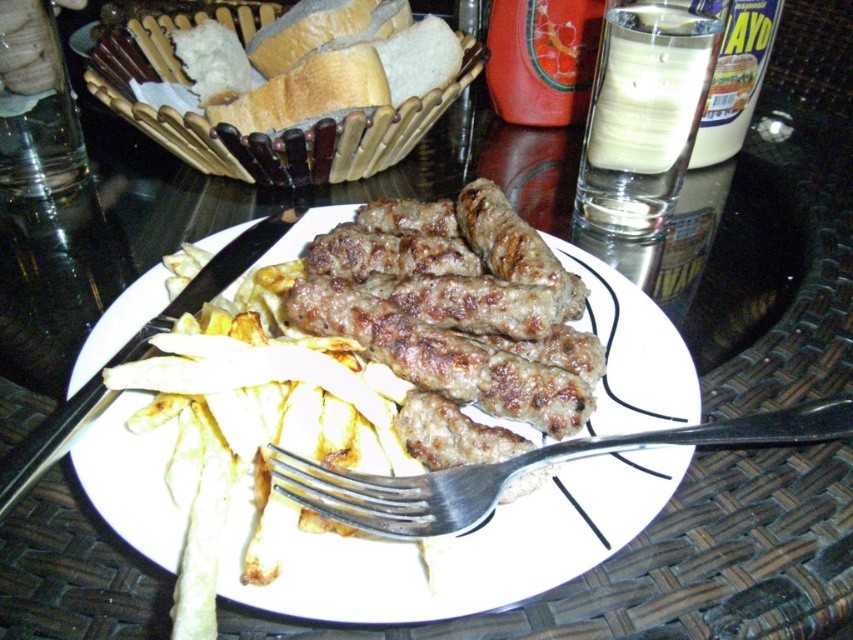
Who is positioned more to the left, clear glass at upper right or silver metallic fork at plate center?

Positioned to the left is silver metallic fork at plate center.

Locate an element on the screen. This screenshot has width=853, height=640. clear glass at upper right is located at coordinates (643, 113).

Which is in front, point (671, 64) or point (724, 444)?

Point (724, 444) is more forward.

Identify the location of clear glass at upper right. This screenshot has width=853, height=640. (643, 113).

Does white matte plate at center have a smaller size compared to bread basket at upper left?

Yes, white matte plate at center is smaller than bread basket at upper left.

Who is taller, white matte plate at center or bread basket at upper left?

bread basket at upper left

Between point (691, 404) and point (288, 157), which one is positioned in front?

Point (691, 404) is more forward.

Identify the location of white matte plate at center. This screenshot has width=853, height=640. (459, 548).

Identify the location of golden crispy fries at center. (248, 422).

Is point (221, 525) positioned behind point (396, 120)?

No, it is in front of (396, 120).

Locate an element on the screen. The image size is (853, 640). golden crispy fries at center is located at coordinates (248, 422).